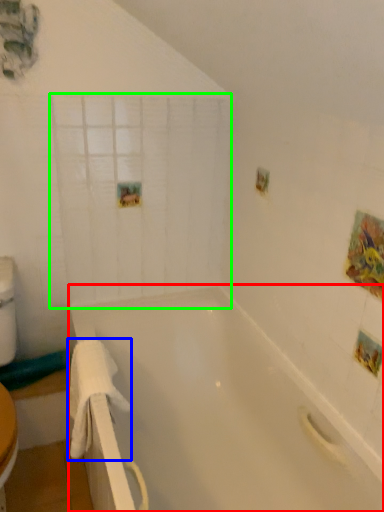
Question: Estimate the real-world distances between objects in this image. Which object is farther from bathtub (highlighted by a red box), towel/napkin (highlighted by a blue box) or glass door (highlighted by a green box)?

Choices:
 (A) towel/napkin
 (B) glass door

Answer: (B)